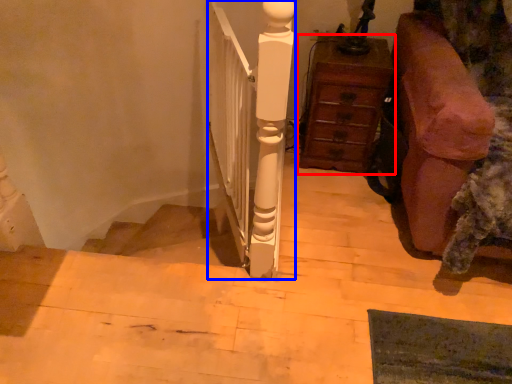
Question: Which object is further to the camera taking this photo, chest of drawers (highlighted by a red box) or rail (highlighted by a blue box)?

Choices:
 (A) chest of drawers
 (B) rail

Answer: (A)